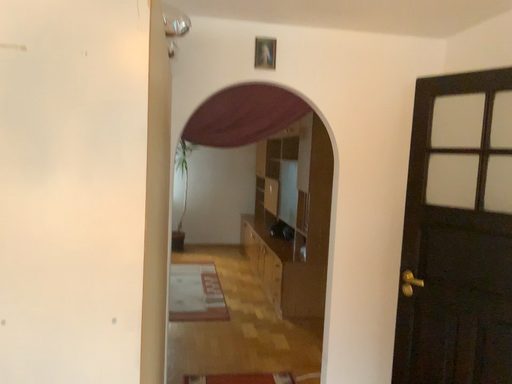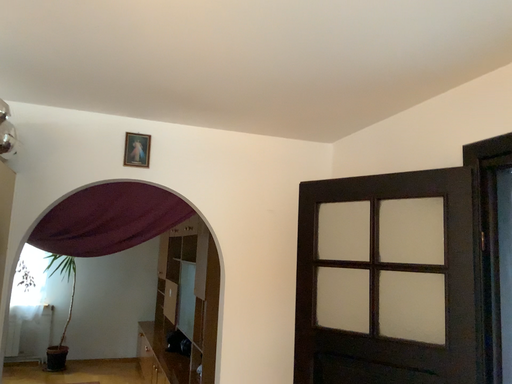
Question: How did the camera likely rotate when shooting the video?

Choices:
 (A) rotated upward
 (B) rotated downward

Answer: (A)